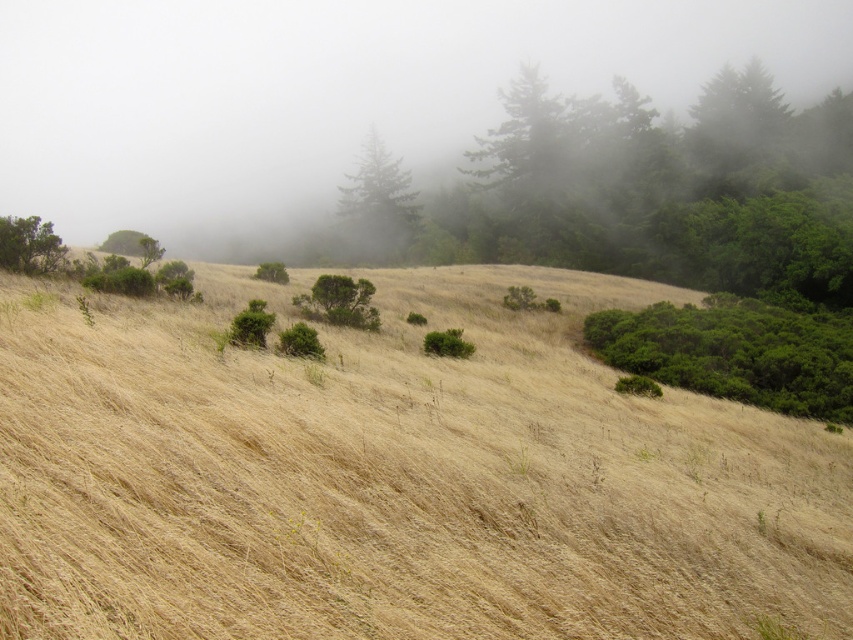
Question: Is foggy mist at upper center wider than green leafy bush at center?

Choices:
 (A) no
 (B) yes

Answer: (B)

Question: Can you confirm if dry grass at center is bigger than green matte bush at upper left?

Choices:
 (A) no
 (B) yes

Answer: (B)

Question: Which point is closer to the camera?

Choices:
 (A) (277, 268)
 (B) (235, 321)
 (C) (457, 58)

Answer: (B)

Question: Is the position of dry grass at center less distant than that of green leafy bush at center?

Choices:
 (A) yes
 (B) no

Answer: (A)

Question: Which object is closer to the camera taking this photo?

Choices:
 (A) green matte tree at center
 (B) dry grass at center

Answer: (B)

Question: Estimate the real-world distances between objects in this image. Which object is farther from the green leafy bush at center?

Choices:
 (A) green matte bush at upper left
 (B) green leafy shrub at center
 (C) dry grass at center
 (D) green leafy tree at upper left

Answer: (B)